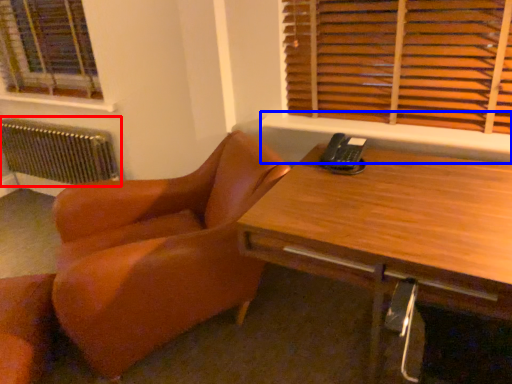
Question: Which object is further to the camera taking this photo, radiator (highlighted by a red box) or window sill (highlighted by a blue box)?

Choices:
 (A) radiator
 (B) window sill

Answer: (A)